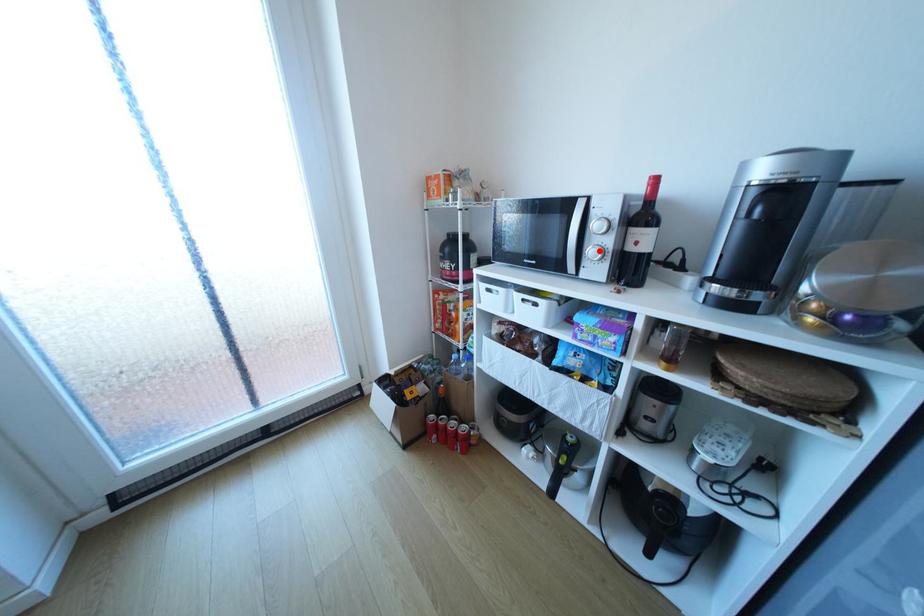
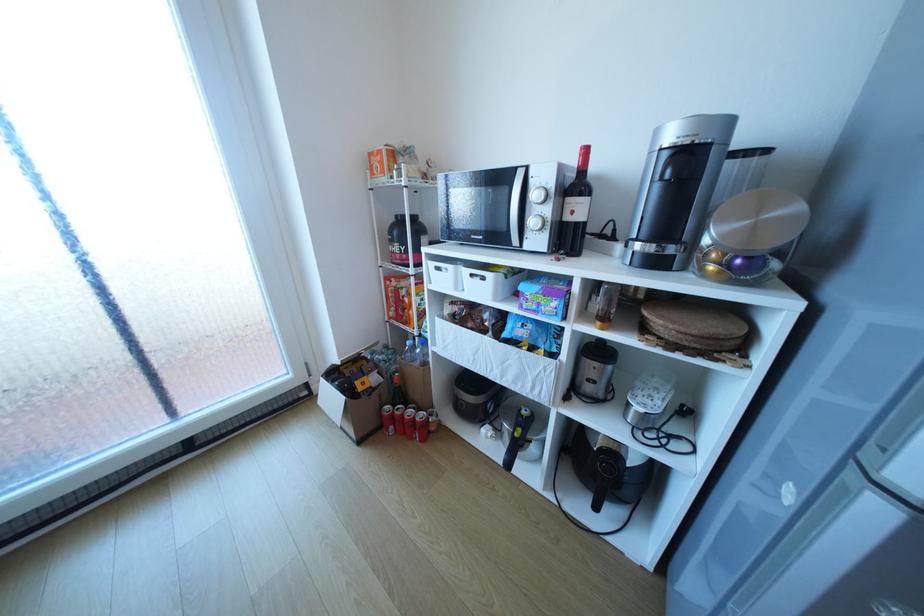
Locate, in the second image, the point that corresponds to the highlighted location in the first image.

(541, 222)